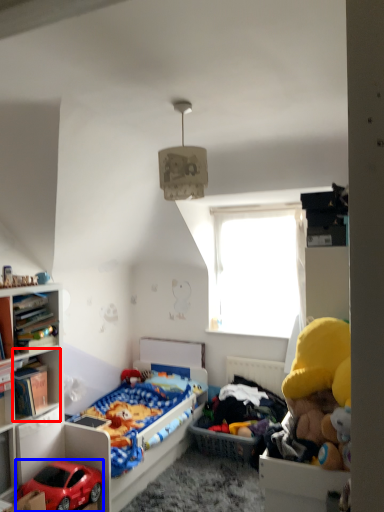
Question: Which object is further to the camera taking this photo, cabinet (highlighted by a red box) or car (highlighted by a blue box)?

Choices:
 (A) cabinet
 (B) car

Answer: (A)